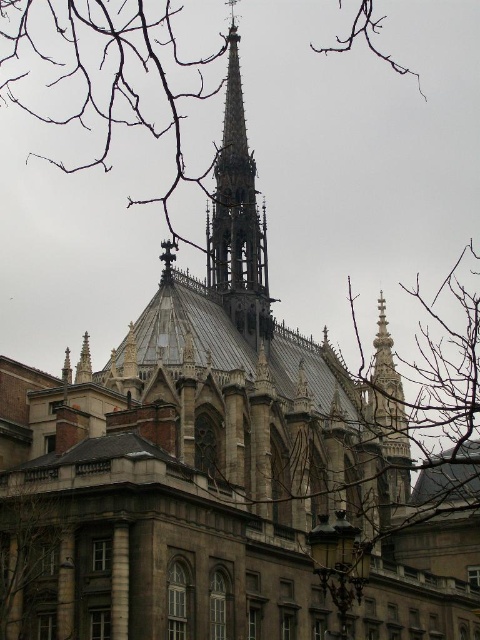
Question: Which point is farther to the camera?

Choices:
 (A) (375, 400)
 (B) (57, 88)
 (C) (15, 524)

Answer: (B)

Question: Among these points, which one is nearest to the camera?

Choices:
 (A) (397, 497)
 (B) (37, 636)
 (C) (235, 138)
 (D) (383, 433)

Answer: (B)

Question: Is bare branches at upper center closer to the viewer compared to brown wood tree at center?

Choices:
 (A) no
 (B) yes

Answer: (B)

Question: Is stone spire at center to the left of smooth stone spire at center from the viewer's perspective?

Choices:
 (A) yes
 (B) no

Answer: (A)

Question: Among these objects, which one is farthest from the camera?

Choices:
 (A) stone spire at center
 (B) brown wood tree at center

Answer: (A)

Question: From the image, what is the correct spatial relationship of bare branches at upper center in relation to stone spire at center?

Choices:
 (A) right
 (B) left

Answer: (A)